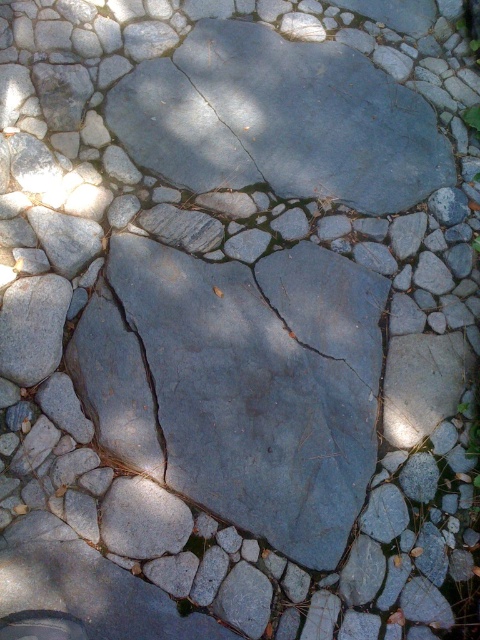
Is gray rough stone at center taller than gray rough stone crack at center?

Correct, gray rough stone at center is much taller as gray rough stone crack at center.

Who is lower down, gray rough stone at center or gray rough stone crack at center?

gray rough stone at center

Does point (275, 292) come in front of point (119, 452)?

No, (275, 292) is further to viewer.

The width and height of the screenshot is (480, 640). I want to click on gray rough stone at center, so click(240, 385).